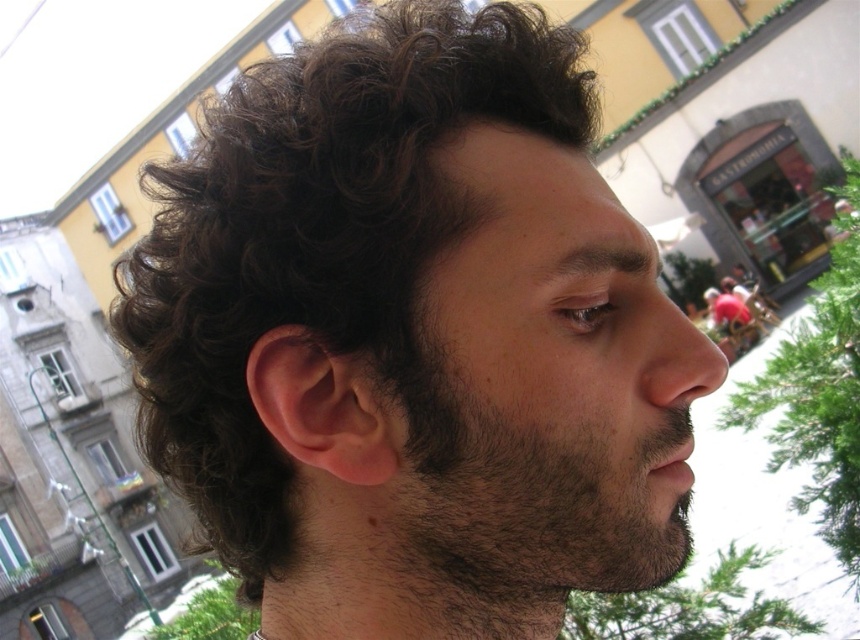
Question: Which of these objects is positioned farthest from the dark brown fuzzy beard at center?

Choices:
 (A) brown hairy mouth at lower center
 (B) dark brown curly hair at center

Answer: (B)

Question: Can you confirm if dark brown curly hair at center is positioned to the right of dark brown fuzzy beard at center?

Choices:
 (A) no
 (B) yes

Answer: (A)

Question: Estimate the real-world distances between objects in this image. Which object is farther from the dark brown fuzzy beard at center?

Choices:
 (A) brown hairy mouth at lower center
 (B) dark brown curly hair at center

Answer: (B)

Question: Is dark brown curly hair at center smaller than dark brown fuzzy beard at center?

Choices:
 (A) no
 (B) yes

Answer: (A)

Question: Does dark brown curly hair at center come in front of dark brown fuzzy beard at center?

Choices:
 (A) yes
 (B) no

Answer: (A)

Question: Which point appears farthest from the camera in this image?

Choices:
 (A) (213, 413)
 (B) (679, 508)
 (C) (679, 429)

Answer: (B)